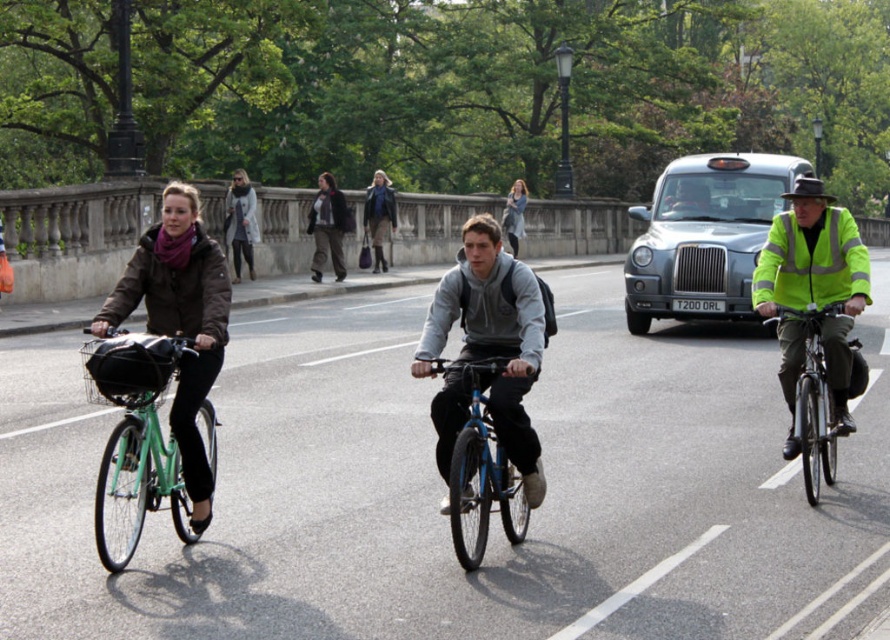
Question: Can you confirm if gray fleece jacket at center is bigger than matte black coat at center?

Choices:
 (A) no
 (B) yes

Answer: (B)

Question: In this image, where is green matte bicycle at center located relative to black matte bicycle helmet at left?

Choices:
 (A) right
 (B) left

Answer: (A)

Question: Which point is closer to the camera?

Choices:
 (A) (243, 173)
 (B) (801, 269)
 (C) (316, 234)
 (D) (346, 220)

Answer: (B)

Question: Which object is the closest to the gray fleece jacket at center?

Choices:
 (A) matte black jacket at center
 (B) light blue denim jacket at center

Answer: (A)

Question: Which point is farther to the camera?

Choices:
 (A) matte brown coat at center
 (B) silver metallic taxi at center
 (C) light blue denim jacket at center

Answer: (C)

Question: Does matte black jacket at center have a smaller size compared to light brown leather coat at center?

Choices:
 (A) no
 (B) yes

Answer: (B)